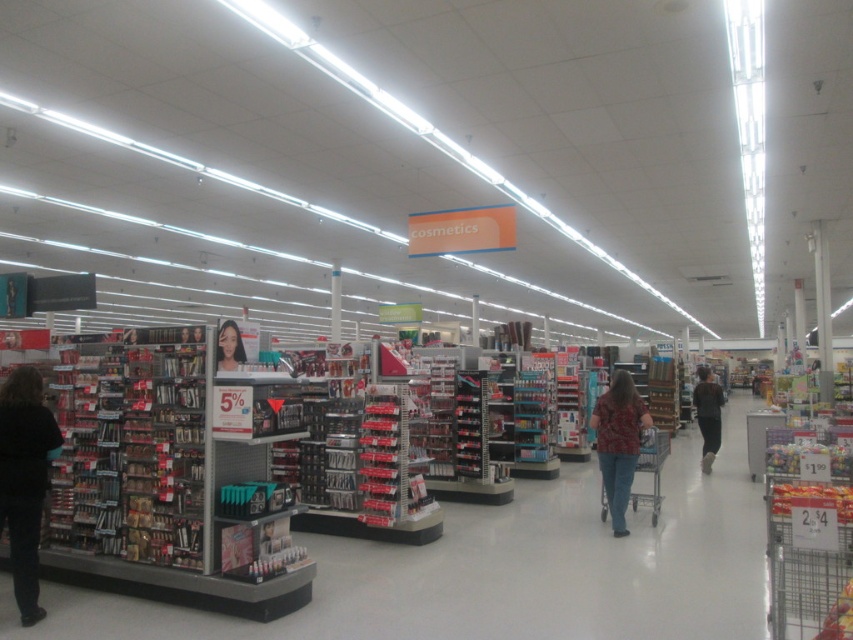
You are standing in the cosmetics section of a retail store. You see a dark brown hair at left located at point (x=24, y=480). Can you tell me what is the exact location of the dark brown hair at left?

The dark brown hair at left is located at point (x=24, y=480).

You are a customer in the store and want to place both the floral shirt at center and the brown fuzzy sweater at center into your shopping bag. The bag can only hold items that are narrower than 18 inches. Which item is more likely to fit in the bag?

The floral shirt at center has a lesser width compared to the brown fuzzy sweater at center, so it is more likely to fit in the bag.